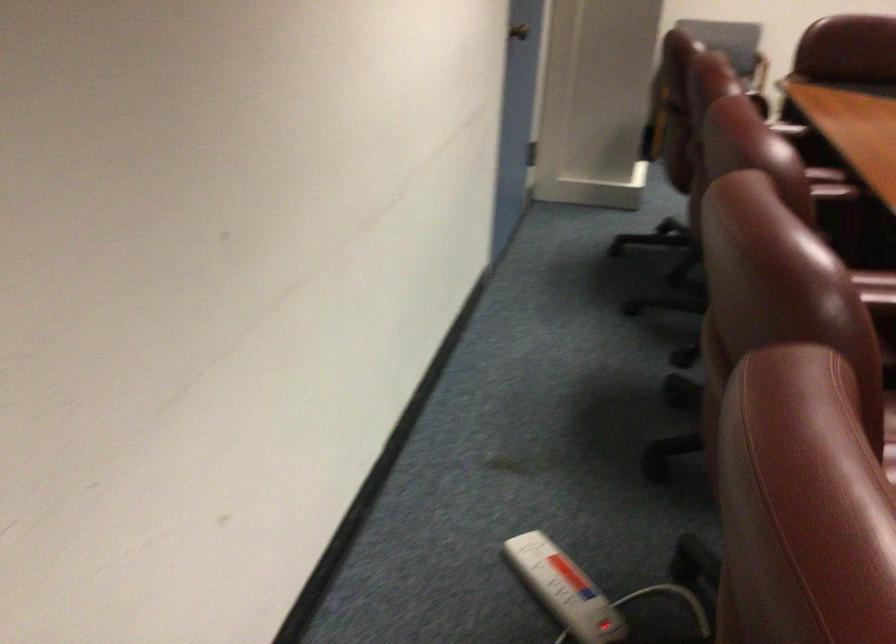
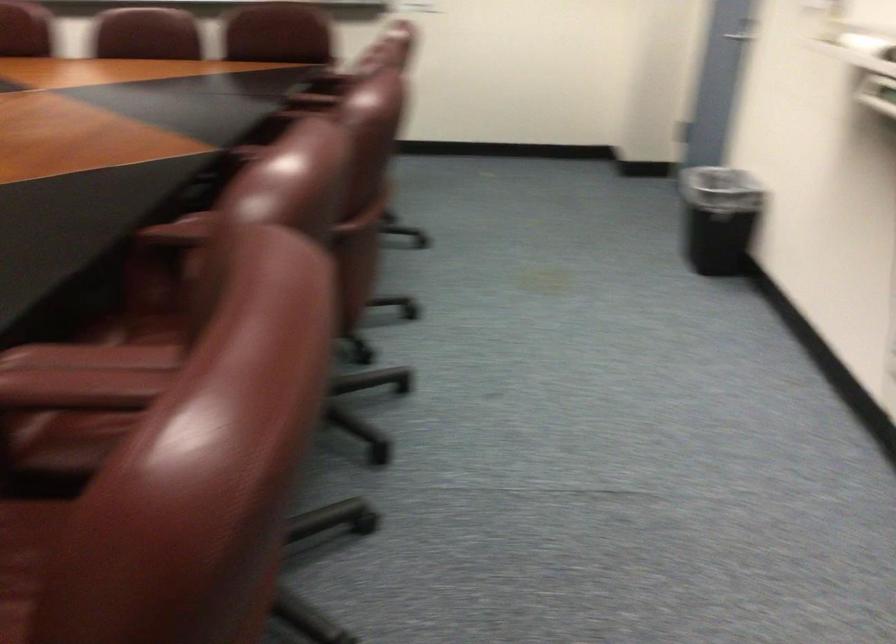
How did the camera likely rotate?

The camera rotated toward right-down.